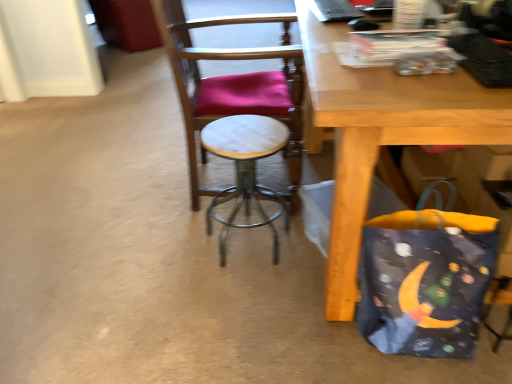
Question: Visually, is marble seat at center positioned to the left or to the right of dark blue fabric bag at lower right?

Choices:
 (A) left
 (B) right

Answer: (A)

Question: From a real-world perspective, is marble seat at center positioned above or below dark blue fabric bag at lower right?

Choices:
 (A) below
 (B) above

Answer: (B)

Question: Based on their relative distances, which object is nearer to the white marble stool at center?

Choices:
 (A) marble seat at center
 (B) dark blue fabric bag at lower right

Answer: (A)

Question: Based on their relative distances, which object is nearer to the white marble stool at center?

Choices:
 (A) dark blue fabric bag at lower right
 (B) marble seat at center

Answer: (B)